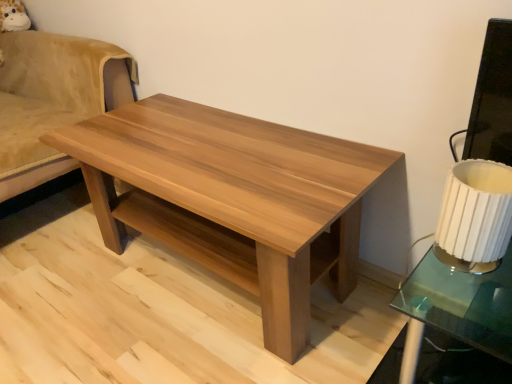
What is the approximate width of light brown wood swivel chair at left?

It is 81.94 centimeters.

Where is `natural wood coffee table at center`? natural wood coffee table at center is located at coordinates (232, 199).

Where is `white pleated fabric lampshade at right`? Image resolution: width=512 pixels, height=384 pixels. white pleated fabric lampshade at right is located at coordinates (475, 216).

This screenshot has height=384, width=512. I want to click on light brown wood swivel chair at left, so pos(53,99).

Which is more to the right, natural wood coffee table at center or light brown wood swivel chair at left?

natural wood coffee table at center.

Between natural wood coffee table at center and light brown wood swivel chair at left, which one is positioned behind?

light brown wood swivel chair at left.

From a real-world perspective, is natural wood coffee table at center positioned under light brown wood swivel chair at left based on gravity?

Indeed, from a real-world perspective, natural wood coffee table at center is positioned beneath light brown wood swivel chair at left.

From the image's perspective, between natural wood coffee table at center and light brown wood swivel chair at left, which one is located above?

light brown wood swivel chair at left is shown above in the image.

Which object is thinner, light brown wood swivel chair at left or natural wood coffee table at center?

With smaller width is natural wood coffee table at center.

Are light brown wood swivel chair at left and natural wood coffee table at center far apart?

light brown wood swivel chair at left is actually quite close to natural wood coffee table at center.

Which is closer, (34, 142) or (326, 193)?

The point (326, 193) is more forward.

Would you say light brown wood swivel chair at left contains white pleated fabric lampshade at right?

No, white pleated fabric lampshade at right is not surrounded by light brown wood swivel chair at left.

Identify the location of table lamp on the right of the light brown wood swivel chair at left. The image size is (512, 384). (475, 216).

Is light brown wood swivel chair at left taller than white pleated fabric lampshade at right?

Yes, light brown wood swivel chair at left is taller than white pleated fabric lampshade at right.

Does light brown wood swivel chair at left come behind white pleated fabric lampshade at right?

Yes, light brown wood swivel chair at left is further from the viewer.

From a real-world perspective, is natural wood coffee table at center physically above white pleated fabric lampshade at right?

Incorrect, from a real-world perspective, natural wood coffee table at center is lower than white pleated fabric lampshade at right.

Does natural wood coffee table at center have a greater width compared to white pleated fabric lampshade at right?

Indeed, natural wood coffee table at center has a greater width compared to white pleated fabric lampshade at right.

Does point (336, 138) come behind point (508, 225)?

That is True.

Looking at the image, does white pleated fabric lampshade at right seem bigger or smaller compared to light brown wood swivel chair at left?

Clearly, white pleated fabric lampshade at right is smaller in size than light brown wood swivel chair at left.

Can we say white pleated fabric lampshade at right lies outside light brown wood swivel chair at left?

white pleated fabric lampshade at right lies outside light brown wood swivel chair at left's area.

From a real-world perspective, relative to light brown wood swivel chair at left, is white pleated fabric lampshade at right vertically above or below?

white pleated fabric lampshade at right is above light brown wood swivel chair at left.

Is white pleated fabric lampshade at right behind natural wood coffee table at center?

No, it is not.

Which object is wider, white pleated fabric lampshade at right or natural wood coffee table at center?

natural wood coffee table at center.

Is white pleated fabric lampshade at right inside the boundaries of natural wood coffee table at center, or outside?

white pleated fabric lampshade at right lies outside natural wood coffee table at center.

I want to click on coffee table below the light brown wood swivel chair at left (from the image's perspective), so click(232, 199).

This screenshot has height=384, width=512. I want to click on swivel chair located above the natural wood coffee table at center (from the image's perspective), so click(53, 99).

Estimate the real-world distances between objects in this image. Which object is further from white pleated fabric lampshade at right, light brown wood swivel chair at left or natural wood coffee table at center?

Among the two, light brown wood swivel chair at left is located further to white pleated fabric lampshade at right.

Which object lies nearer to the anchor point white pleated fabric lampshade at right, natural wood coffee table at center or light brown wood swivel chair at left?

Based on the image, natural wood coffee table at center appears to be nearer to white pleated fabric lampshade at right.

Which object lies nearer to the anchor point light brown wood swivel chair at left, natural wood coffee table at center or white pleated fabric lampshade at right?

natural wood coffee table at center is positioned closer to the anchor light brown wood swivel chair at left.

When comparing their distances from natural wood coffee table at center, does light brown wood swivel chair at left or white pleated fabric lampshade at right seem closer?

Based on the image, white pleated fabric lampshade at right appears to be nearer to natural wood coffee table at center.

From the image, which object appears to be nearer to light brown wood swivel chair at left, white pleated fabric lampshade at right or natural wood coffee table at center?

Among the two, natural wood coffee table at center is located nearer to light brown wood swivel chair at left.

Looking at the image, which one is located closer to natural wood coffee table at center, white pleated fabric lampshade at right or light brown wood swivel chair at left?

The object closer to natural wood coffee table at center is white pleated fabric lampshade at right.

You are a GUI agent. You are given a task and a screenshot of the screen. Output one action in this format:
    pyautogui.click(x=<x>, y=<y>)
    Task: Click on the coffee table situated between light brown wood swivel chair at left and white pleated fabric lampshade at right from left to right
    
    Given the screenshot: What is the action you would take?
    pyautogui.click(x=232, y=199)